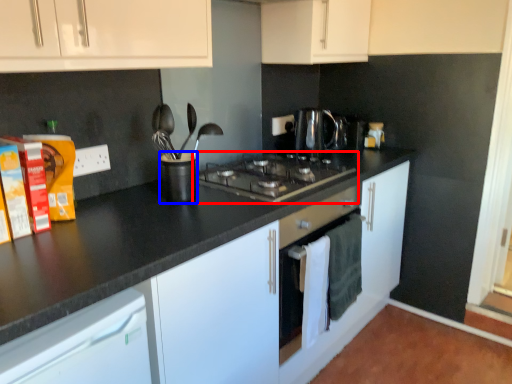
Question: Among these objects, which one is farthest to the camera, gas stove (highlighted by a red box) or appliance (highlighted by a blue box)?

Choices:
 (A) gas stove
 (B) appliance

Answer: (A)